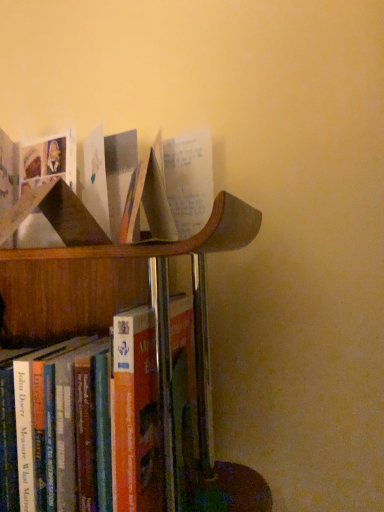
Question: Is hardcover book at lower left, arranged as the 2th book when viewed from the top, oriented towards matte cardboard book at upper left, marked as the 1th book in a top-to-bottom arrangement?

Choices:
 (A) yes
 (B) no

Answer: (B)

Question: Does hardcover book at lower left, arranged as the 2th book when viewed from the top, lie in front of matte cardboard book at upper left, marked as the 1th book in a top-to-bottom arrangement?

Choices:
 (A) yes
 (B) no

Answer: (B)

Question: Does hardcover book at lower left, arranged as the 2th book when viewed from the top, appear on the left side of matte cardboard book at upper left, which is counted as the second book, starting from the bottom?

Choices:
 (A) yes
 (B) no

Answer: (A)

Question: From the image's perspective, does hardcover book at lower left, the 1th book positioned from the bottom, appear lower than matte cardboard book at upper left, marked as the 1th book in a top-to-bottom arrangement?

Choices:
 (A) no
 (B) yes

Answer: (B)

Question: From a real-world perspective, is hardcover book at lower left, arranged as the 2th book when viewed from the top, beneath matte cardboard book at upper left, which is counted as the second book, starting from the bottom?

Choices:
 (A) no
 (B) yes

Answer: (B)

Question: Is hardcover book at lower left, arranged as the 2th book when viewed from the top, wider than matte cardboard book at upper left, which is counted as the second book, starting from the bottom?

Choices:
 (A) yes
 (B) no

Answer: (A)

Question: Can you confirm if matte cardboard book at upper left, which is counted as the second book, starting from the bottom, is positioned to the right of hardcover book at lower left, arranged as the 2th book when viewed from the top?

Choices:
 (A) no
 (B) yes

Answer: (B)

Question: From a real-world perspective, is matte cardboard book at upper left, which is counted as the second book, starting from the bottom, located beneath hardcover book at lower left, the 1th book positioned from the bottom?

Choices:
 (A) no
 (B) yes

Answer: (A)

Question: Does matte cardboard book at upper left, marked as the 1th book in a top-to-bottom arrangement, lie behind hardcover book at lower left, the 1th book positioned from the bottom?

Choices:
 (A) yes
 (B) no

Answer: (B)

Question: Is matte cardboard book at upper left, marked as the 1th book in a top-to-bottom arrangement, shorter than hardcover book at lower left, arranged as the 2th book when viewed from the top?

Choices:
 (A) no
 (B) yes

Answer: (B)

Question: Is matte cardboard book at upper left, which is counted as the second book, starting from the bottom, not close to hardcover book at lower left, arranged as the 2th book when viewed from the top?

Choices:
 (A) yes
 (B) no

Answer: (B)

Question: From a real-world perspective, does matte cardboard book at upper left, which is counted as the second book, starting from the bottom, stand above hardcover book at lower left, arranged as the 2th book when viewed from the top?

Choices:
 (A) no
 (B) yes

Answer: (B)

Question: From the image's perspective, is hardcover book at lower left, the 1th book positioned from the bottom, positioned above or below matte cardboard book at upper left, marked as the 1th book in a top-to-bottom arrangement?

Choices:
 (A) above
 (B) below

Answer: (B)